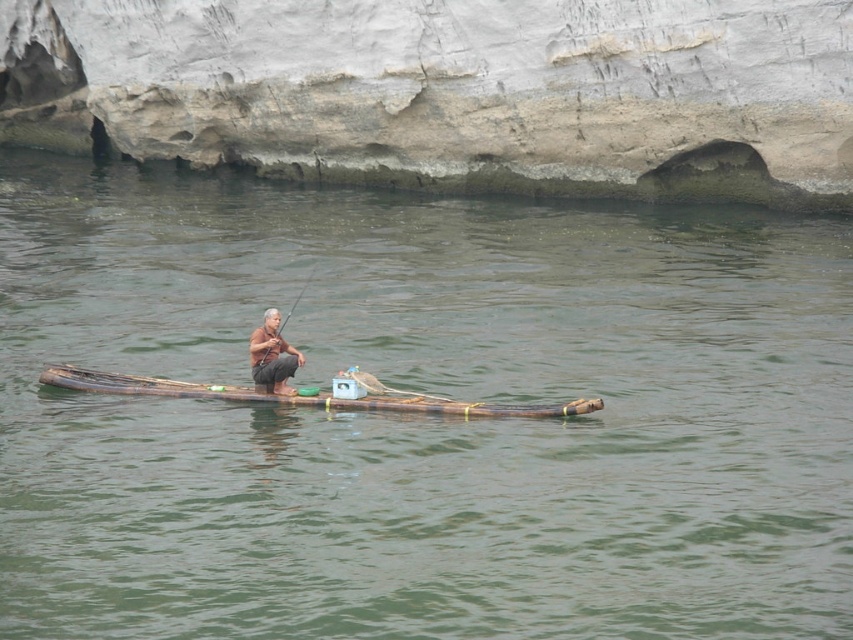
Question: Among these points, which one is nearest to the camera?

Choices:
 (A) (125, 388)
 (B) (286, 314)

Answer: (A)

Question: Estimate the real-world distances between objects in this image. Which object is closer to the brown wood boat at center?

Choices:
 (A) brown matte fisherman at center
 (B) wooden textured paddle at center

Answer: (A)

Question: Is brown wood boat at center further to camera compared to brown matte fisherman at center?

Choices:
 (A) no
 (B) yes

Answer: (B)

Question: Can you confirm if brown matte fisherman at center is positioned to the left of wooden textured paddle at center?

Choices:
 (A) yes
 (B) no

Answer: (B)

Question: Which object is closer to the camera taking this photo?

Choices:
 (A) brown matte fisherman at center
 (B) wooden textured paddle at center
 (C) brown wood boat at center

Answer: (A)

Question: Is brown wood boat at center thinner than brown matte fisherman at center?

Choices:
 (A) yes
 (B) no

Answer: (A)